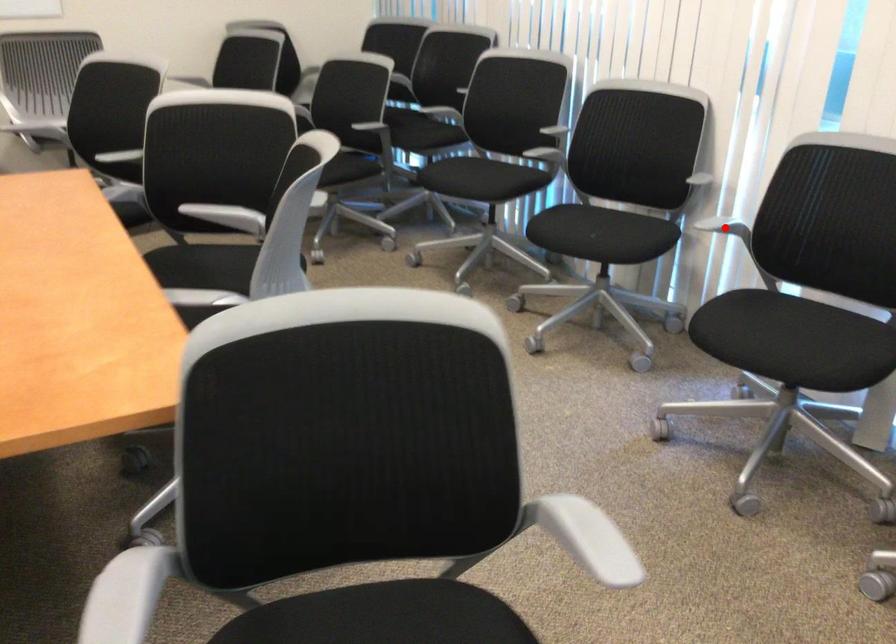
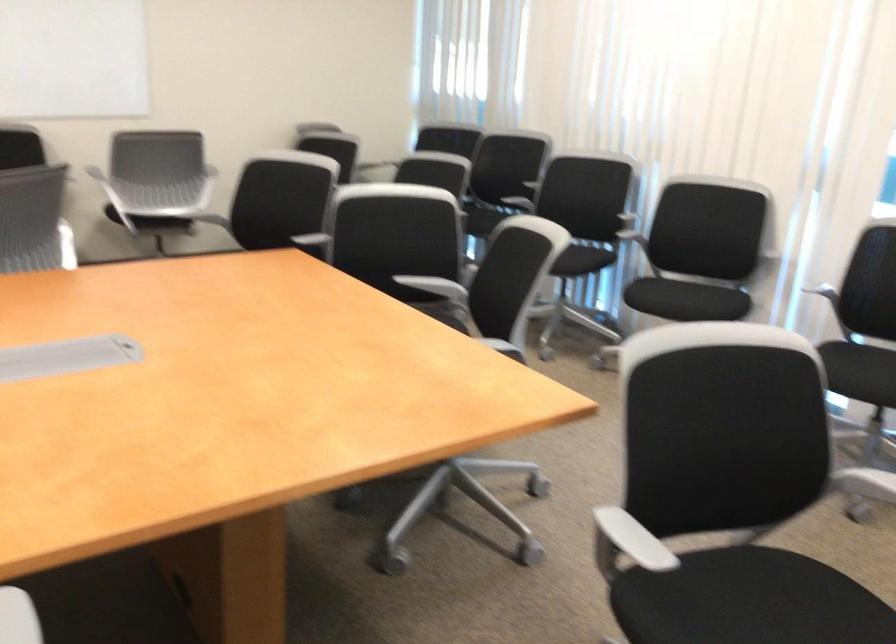
Question: I am providing you with two images of the same scene from different viewpoints. A red point is marked on the first image. At the location where the point appears in image 1, is it still visible in image 2?

Choices:
 (A) Yes
 (B) No

Answer: (B)